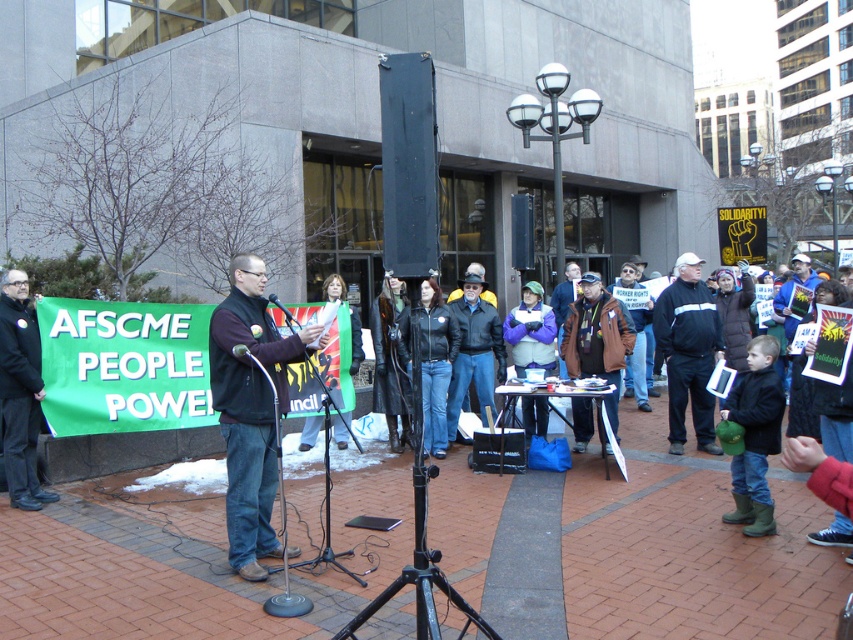
In the scene shown: You are a photographer trying to capture a group photo of the protesters. You need to ensure that both the black jacket at center and the purple fleece jacket at center are in focus. Given that your camera has a depth of field that can cover 4 feet, will both subjects be in focus?

The distance between the black jacket at center and the purple fleece jacket at center is 4.28 feet. Since the depth of field can only cover 4 feet, the two subjects are slightly out of the camera range. Therefore, both subjects may not be fully in focus.

You are a photographer standing at the edge of the crowd, wanting to capture a photo of both the black leather jacket at center and the purple fleece jacket at center in the same frame. The camera you are using has a minimum focusing distance of 1 meter. Can you take the photo without moving closer?

The black leather jacket at center is 87.12 centimeters away from the purple fleece jacket at center. Since 87.12 cm is less than 1 meter, the distance between them is within the camera minimum focusing distance. Therefore, you can take the photo without moving closer.

You are a participant in the protest and want to move from the speaker to the back of the crowd. Which direction should you walk to go from point (689, 269) to point (306, 422)?

To move from point (689, 269) to point (306, 422), you should walk towards the lower right direction since point (689, 269) is in front of point (306, 422).